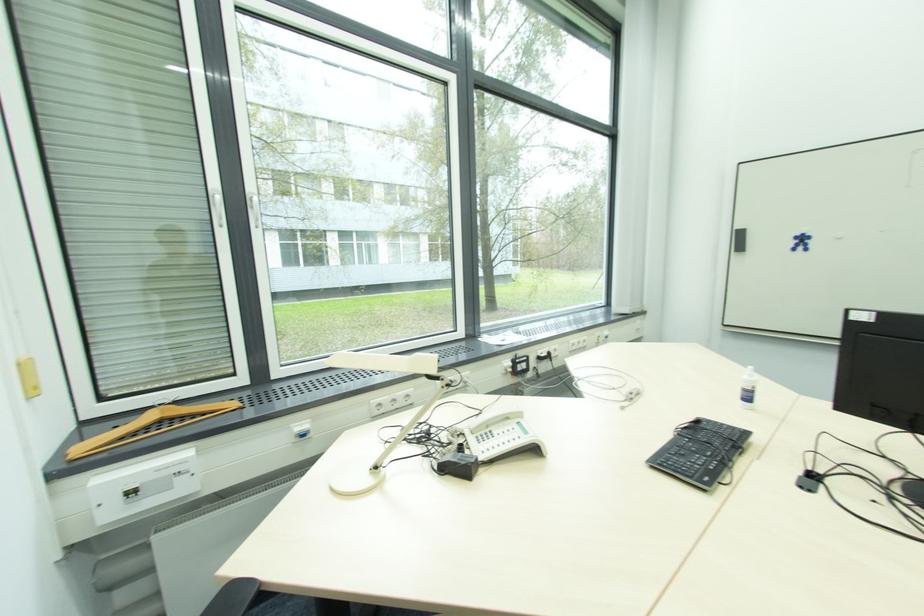
Locate an element on the screen. The width and height of the screenshot is (924, 616). white lamp head is located at coordinates (383, 413).